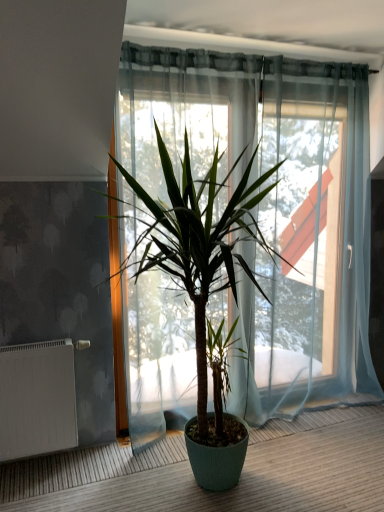
Question: Is white matte radiator at lower left wider or thinner than green matte plant at center?

Choices:
 (A) wide
 (B) thin

Answer: (B)

Question: Looking at the image, does white matte radiator at lower left seem bigger or smaller compared to green matte plant at center?

Choices:
 (A) big
 (B) small

Answer: (B)

Question: In terms of height, does white matte radiator at lower left look taller or shorter compared to green matte plant at center?

Choices:
 (A) short
 (B) tall

Answer: (A)

Question: From the image's perspective, relative to white matte radiator at lower left, is green matte plant at center above or below?

Choices:
 (A) above
 (B) below

Answer: (A)

Question: Would you say green matte plant at center is inside or outside white matte radiator at lower left?

Choices:
 (A) inside
 (B) outside

Answer: (B)

Question: Considering the positions of green matte plant at center and white matte radiator at lower left in the image, is green matte plant at center taller or shorter than white matte radiator at lower left?

Choices:
 (A) short
 (B) tall

Answer: (B)

Question: Based on their sizes in the image, would you say green matte plant at center is bigger or smaller than white matte radiator at lower left?

Choices:
 (A) big
 (B) small

Answer: (A)